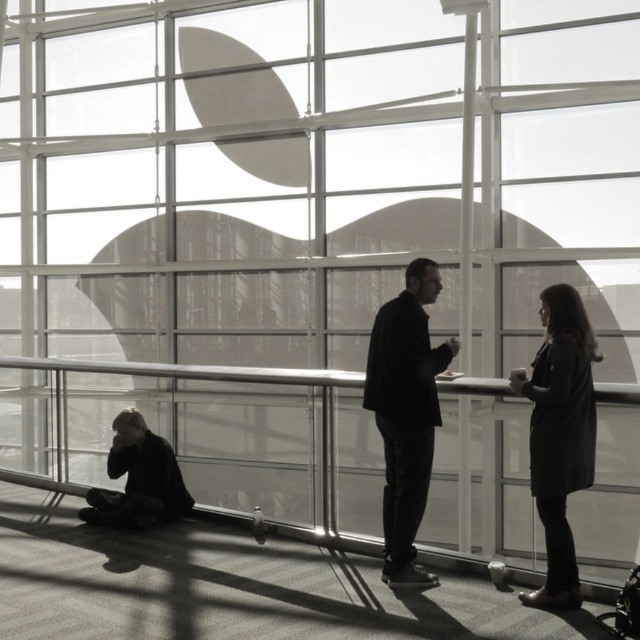
In the scene shown: Can you confirm if dark gray coat at right is positioned below metallic glass rail at lower center?

No.

Does dark gray coat at right have a greater width compared to metallic glass rail at lower center?

In fact, dark gray coat at right might be narrower than metallic glass rail at lower center.

Which is in front, point (568, 461) or point (320, 380)?

Positioned in front is point (568, 461).

Find the location of a particular element. dark gray coat at right is located at coordinates (560, 435).

The height and width of the screenshot is (640, 640). Describe the element at coordinates (404, 413) in the screenshot. I see `black matte suit at center` at that location.

Does black matte suit at center have a greater height compared to dark gray coat at lower left?

Yes.

Who is more distant from viewer, [365,387] or [140,429]?

Point [140,429]

At what (x,y) coordinates should I click in order to perform the action: click on black matte suit at center. Please return your answer as a coordinate pair (x, y). The image size is (640, 640). Looking at the image, I should click on (404, 413).

Can you confirm if black matte suit at center is shorter than metallic glass rail at lower center?

Incorrect, black matte suit at center's height does not fall short of metallic glass rail at lower center's.

Between point (381, 564) and point (321, 413), which one is positioned behind?

Point (321, 413)

Locate an element on the screen. This screenshot has height=640, width=640. black matte suit at center is located at coordinates (404, 413).